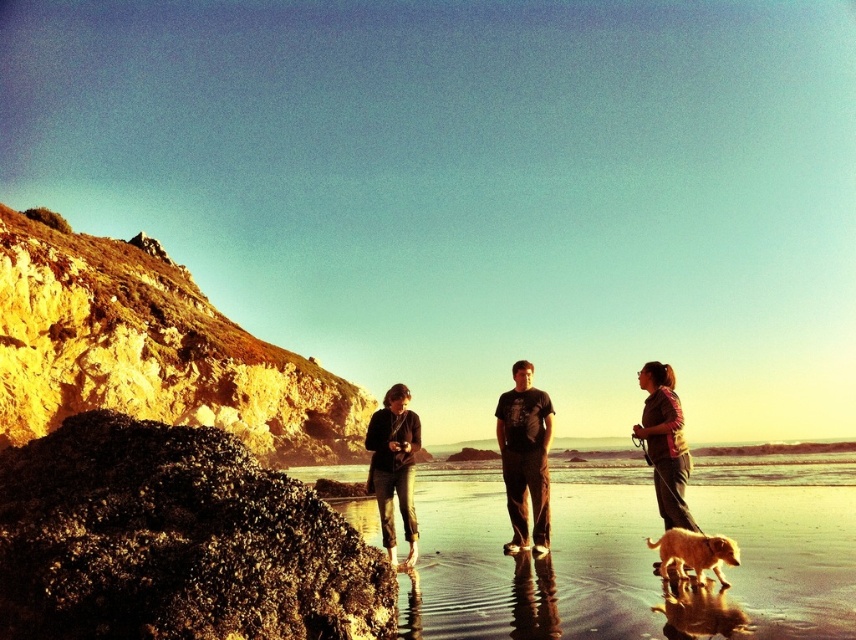
You are a photographer standing on the smooth sand beach at center and want to take a photo of the brown leather jacket at lower right. If your camera has a maximum focus range of 30 feet, will you be able to capture the jacket clearly?

The distance between the smooth sand beach at center and the brown leather jacket at lower right is 32.55 feet, which exceeds the camera maximum focus range of 30 feet. Therefore, the jacket will not be captured clearly.